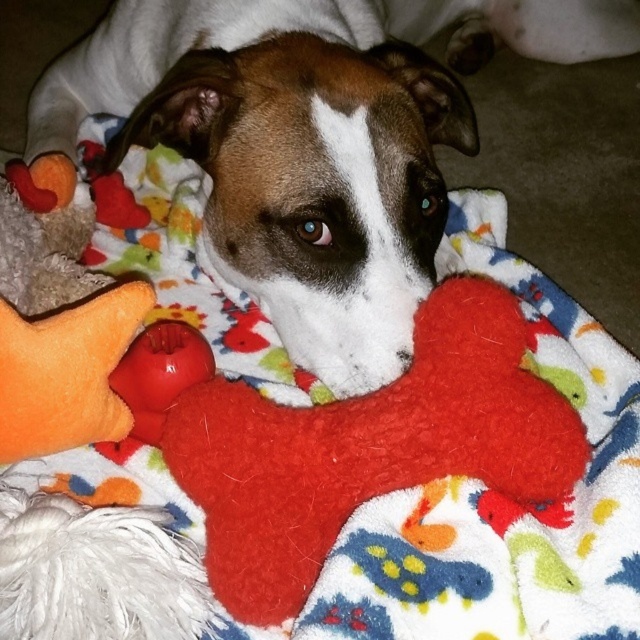
You are a dog owner who wants to stack the fuzzy red bone at center and the rubber ball at center. Which toy should you place at the bottom to ensure stability?

The fuzzy red bone at center is taller than the rubber ball at center, so place the fuzzy red bone at center at the bottom for better stability.

You are a dog owner who wants to choose the wider toy between the matte orange plush toy at lower left and the rubber ball at center for your dog. Which one should you pick?

The matte orange plush toy at lower left is wider than the rubber ball at center, so you should pick the matte orange plush toy at lower left.